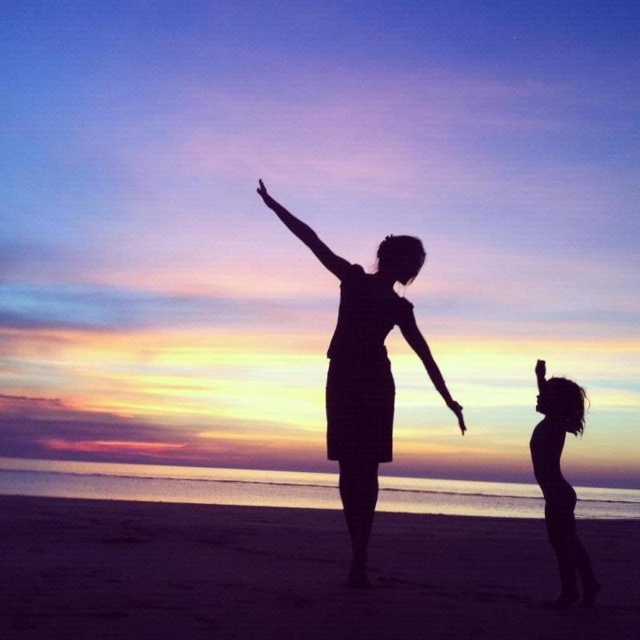
Question: Does silhouette hair at right come in front of silhouette arm at center?

Choices:
 (A) yes
 (B) no

Answer: (A)

Question: Among these objects, which one is farthest from the camera?

Choices:
 (A) silhouette hair at right
 (B) smooth sand at lower center
 (C) silhouette arm at center

Answer: (C)

Question: Which is nearer to the silhouette hair at right?

Choices:
 (A) silky smooth arm at center
 (B) silhouette dress at center
 (C) silhouette arm at center
 (D) smooth sand at lower center

Answer: (A)

Question: Can you confirm if smooth sand at lower center is bigger than silky smooth arm at center?

Choices:
 (A) yes
 (B) no

Answer: (A)

Question: Does smooth sand at lower center come behind silhouette hair at right?

Choices:
 (A) yes
 (B) no

Answer: (B)

Question: Which object is closer to the camera taking this photo?

Choices:
 (A) silhouette dress at center
 (B) silhouette arm at center
 (C) smooth sand at lower center

Answer: (C)